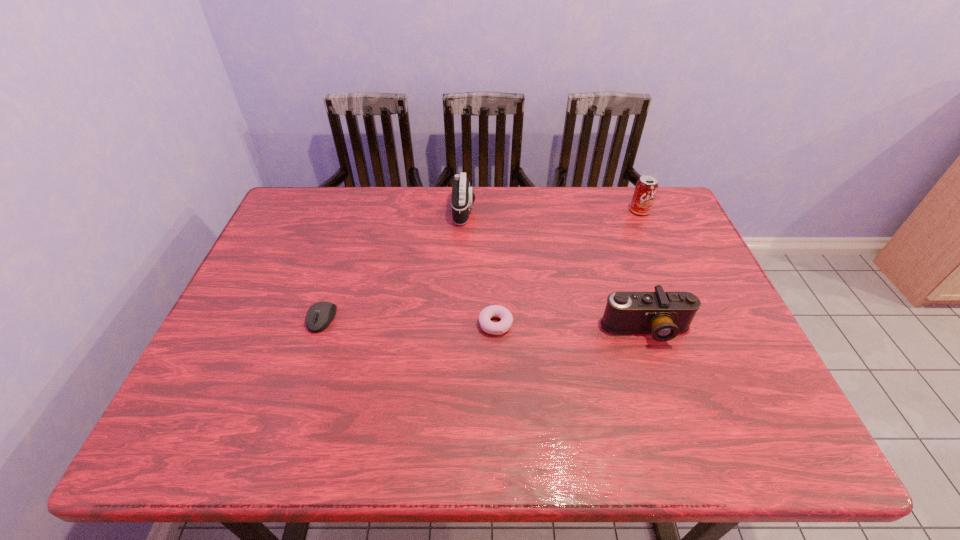
Locate an element on the screen. the third closest object to the third object from right to left is located at coordinates (325, 311).

Identify the location of object that stands as the second closest to the leftmost object. (462, 199).

Where is `vacant space that satisfies the following two spatial constraints: 1. on the back side of the soda can; 2. on the front lens of the farther camera`? Image resolution: width=960 pixels, height=540 pixels. vacant space that satisfies the following two spatial constraints: 1. on the back side of the soda can; 2. on the front lens of the farther camera is located at coordinates (639, 210).

Locate an element on the screen. The image size is (960, 540). vacant area in the image that satisfies the following two spatial constraints: 1. on the front lens of the left camera; 2. on the right side of the doughnut is located at coordinates (x=459, y=324).